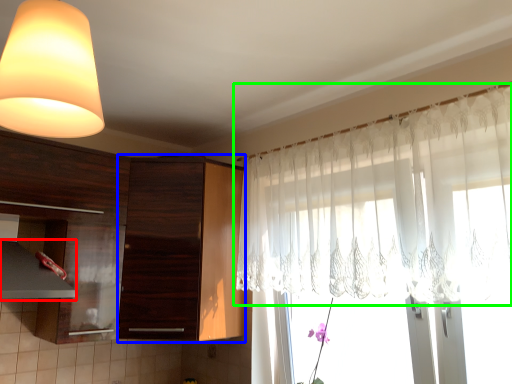
Question: Which is farther away from exhaust hood (highlighted by a red box)? cabinetry (highlighted by a blue box) or curtain (highlighted by a green box)?

Choices:
 (A) cabinetry
 (B) curtain

Answer: (B)